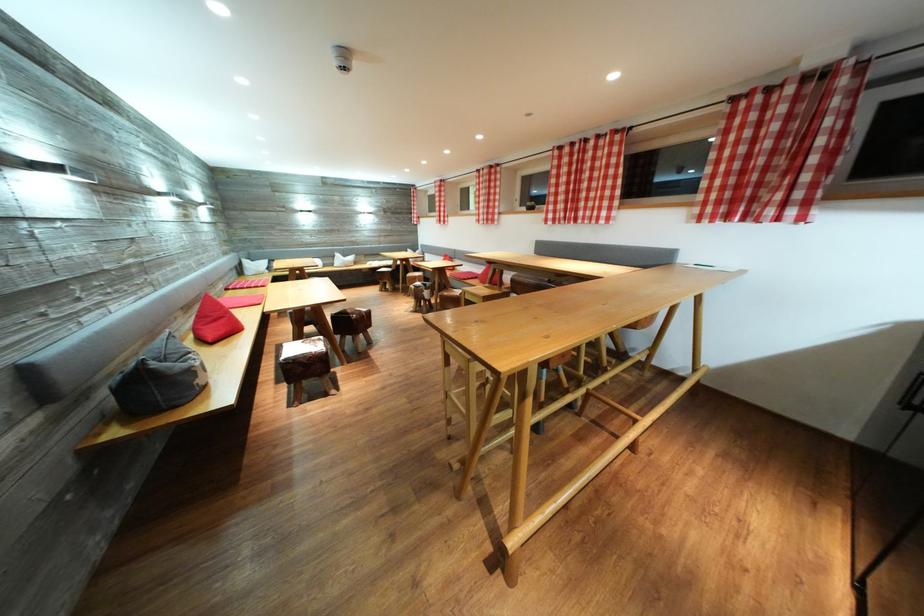
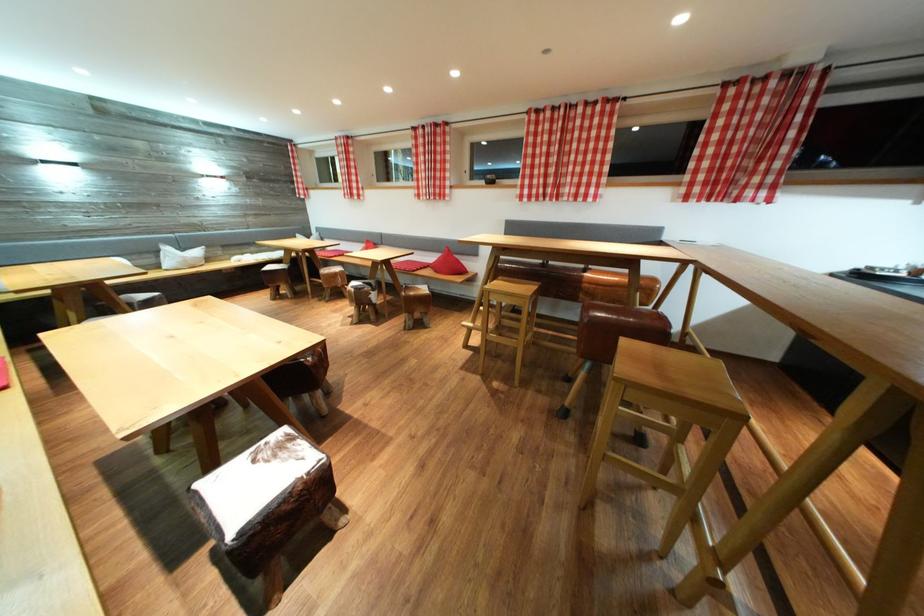
In the second image, find the point that corresponds to pixel 421 292 in the first image.

(362, 294)